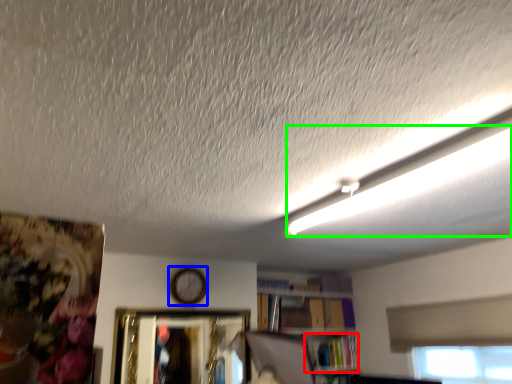
Question: Which is nearer to the book (highlighted by a red box)? clock (highlighted by a blue box) or lighting (highlighted by a green box).

Choices:
 (A) clock
 (B) lighting

Answer: (A)